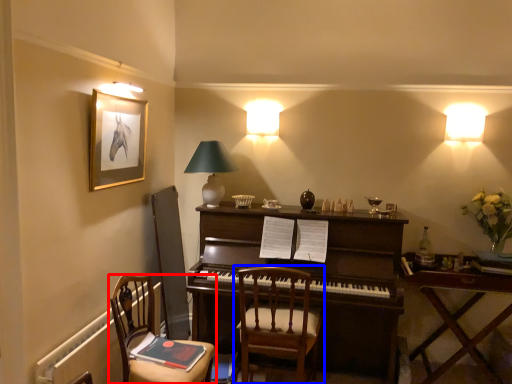
Question: Among these objects, which one is farthest to the camera, chair (highlighted by a red box) or chair (highlighted by a blue box)?

Choices:
 (A) chair
 (B) chair

Answer: (B)